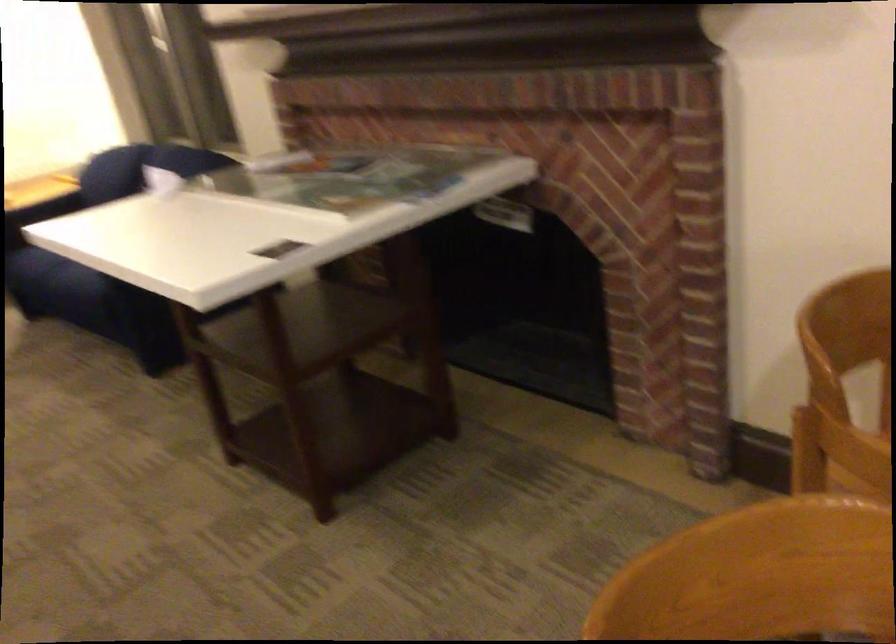
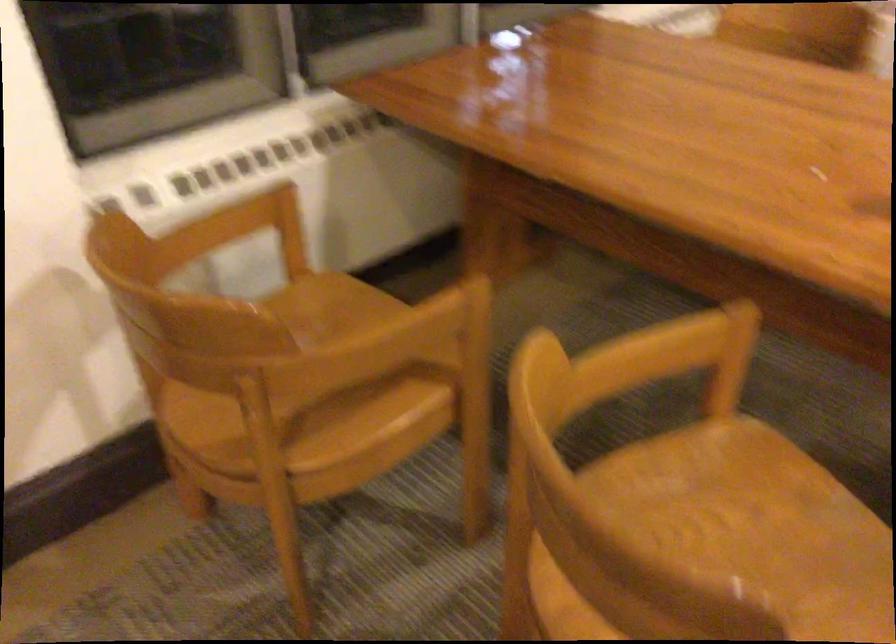
The first image is from the beginning of the video and the second image is from the end. How did the camera likely rotate when shooting the video?

The camera's rotation is toward right-down.